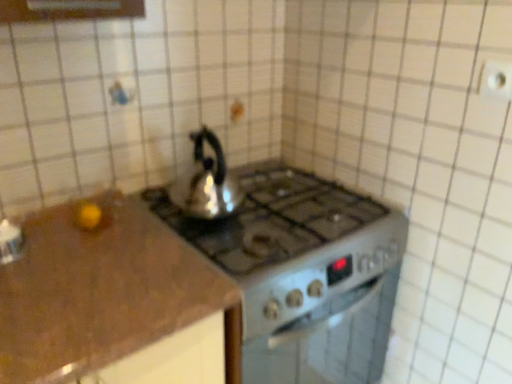
This screenshot has width=512, height=384. Find the location of `vacant space in front of shiny metallic kettle at center`. vacant space in front of shiny metallic kettle at center is located at coordinates (224, 238).